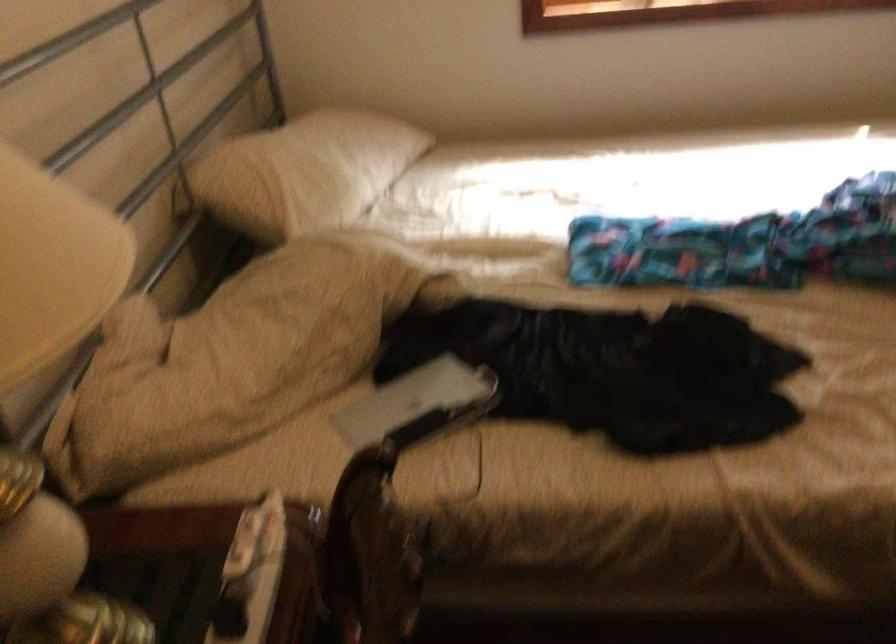
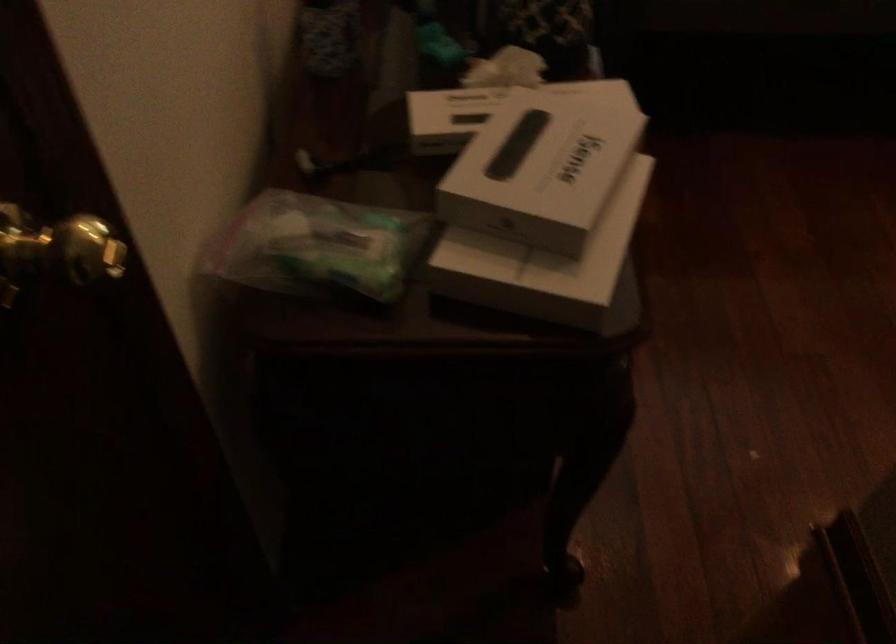
Which direction would the cameraman need to move to produce the second image?

The cameraman moved toward left, backward.